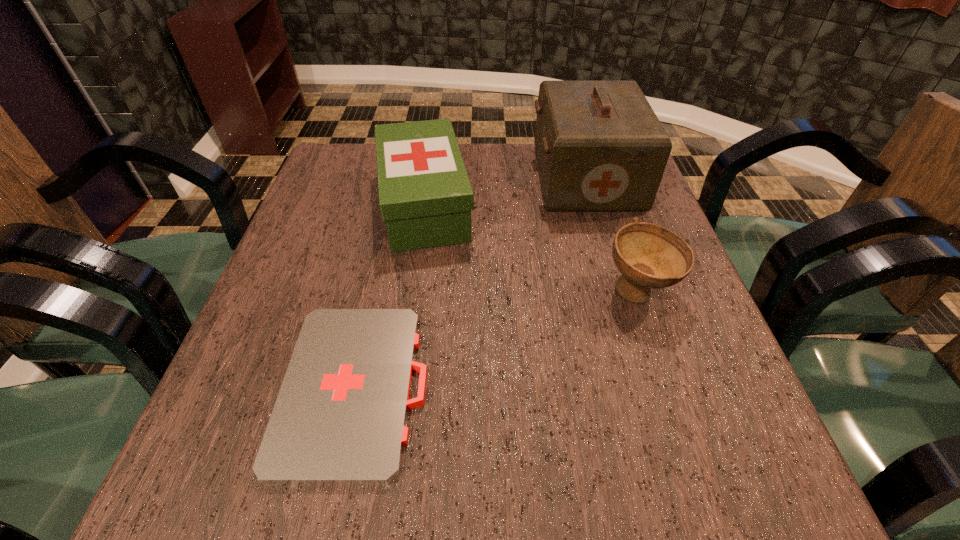
Locate an element on the screen. The image size is (960, 540). object present at the near edge is located at coordinates (340, 416).

Find the location of a particular element. The image size is (960, 540). object present at the left edge is located at coordinates (340, 416).

The height and width of the screenshot is (540, 960). In order to click on the first-aid kit present at the right edge in this screenshot , I will do `click(600, 146)`.

Identify the location of soup bowl present at the right edge. (x=648, y=256).

This screenshot has height=540, width=960. Find the location of `object present at the near left corner`. object present at the near left corner is located at coordinates [340, 416].

Find the location of a particular element. The height and width of the screenshot is (540, 960). object that is at the far right corner is located at coordinates (600, 146).

This screenshot has width=960, height=540. Find the location of `blank space at the far edge of the desktop`. blank space at the far edge of the desktop is located at coordinates (486, 184).

At what (x,y) coordinates should I click in order to perform the action: click on vacant space at the near edge of the desktop. Please return your answer as a coordinate pair (x, y). Image resolution: width=960 pixels, height=540 pixels. Looking at the image, I should click on (447, 503).

Where is `free region at the left edge`? This screenshot has width=960, height=540. free region at the left edge is located at coordinates (324, 198).

Where is `vacant area at the right edge`? This screenshot has width=960, height=540. vacant area at the right edge is located at coordinates (684, 445).